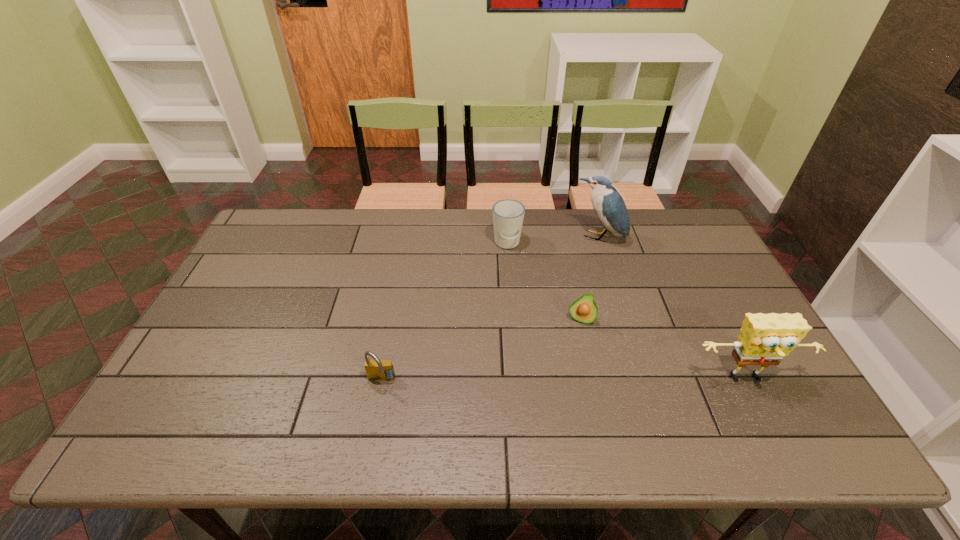
Identify the location of vacant space on the desktop that is between the padlock and the sponge and is positioned at the tip of the bird's beak. This screenshot has width=960, height=540. (528, 380).

This screenshot has height=540, width=960. Identify the location of vacant space on the desktop that is between the padlock and the sponge and is positioned with a handle on the side of the cup. (510, 380).

The image size is (960, 540). I want to click on vacant space on the desktop that is between the leftmost object and the sponge and is positioned on the cut side of the third nearest object, so click(x=565, y=380).